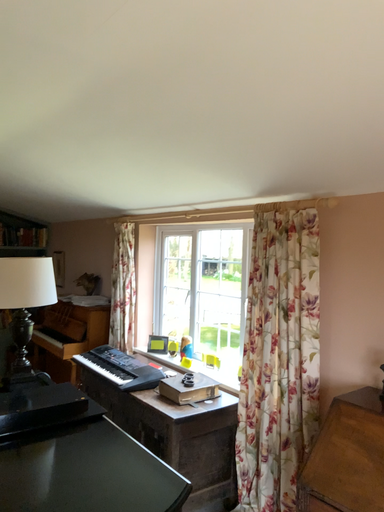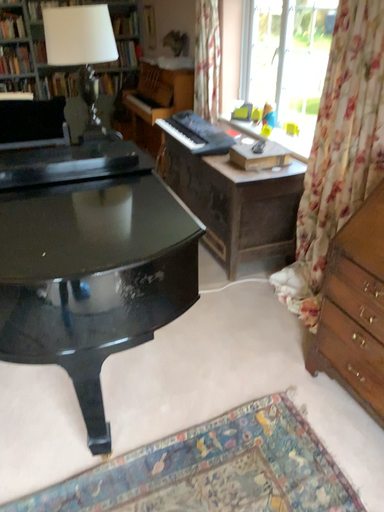
Question: Which way did the camera rotate in the video?

Choices:
 (A) rotated left
 (B) rotated right

Answer: (A)